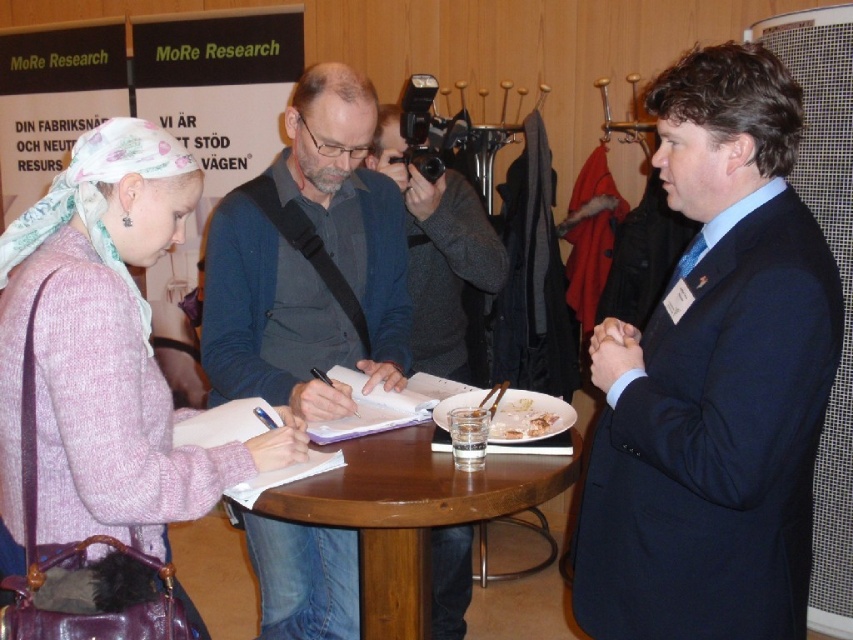
Between dark blue sweater at center and brown wooden table at center, which one is positioned higher?

dark blue sweater at center

Locate an element on the screen. This screenshot has height=640, width=853. dark blue sweater at center is located at coordinates (309, 260).

This screenshot has width=853, height=640. I want to click on dark blue suit at center, so click(x=714, y=378).

Does point (714, 397) come in front of point (505, 428)?

Yes, point (714, 397) is in front of point (505, 428).

Does point (630, 465) lie behind point (531, 412)?

No, it is in front of (531, 412).

Find the location of `dark blue suit at center`. dark blue suit at center is located at coordinates (714, 378).

Is dark blue suit at center wider than matte blue sweater at center?

Incorrect, dark blue suit at center's width does not surpass matte blue sweater at center's.

Who is more distant from viewer, (x=717, y=132) or (x=396, y=161)?

Point (x=396, y=161)

Does point (786, 376) come in front of point (454, 561)?

Yes, it is in front of point (454, 561).

The width and height of the screenshot is (853, 640). What are the coordinates of `dark blue suit at center` in the screenshot? It's located at (714, 378).